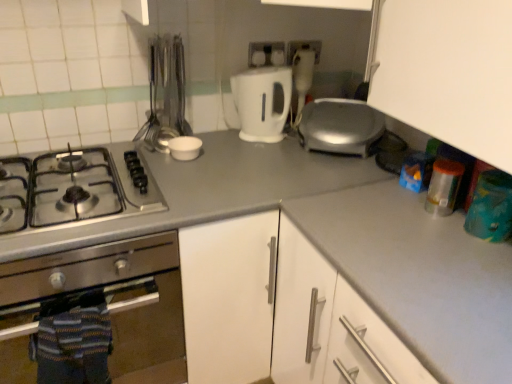
Where is `free space in front of white glossy electric kettle at center, which is the first kitchen appliance in right-to-left order`? Image resolution: width=512 pixels, height=384 pixels. free space in front of white glossy electric kettle at center, which is the first kitchen appliance in right-to-left order is located at coordinates (252, 149).